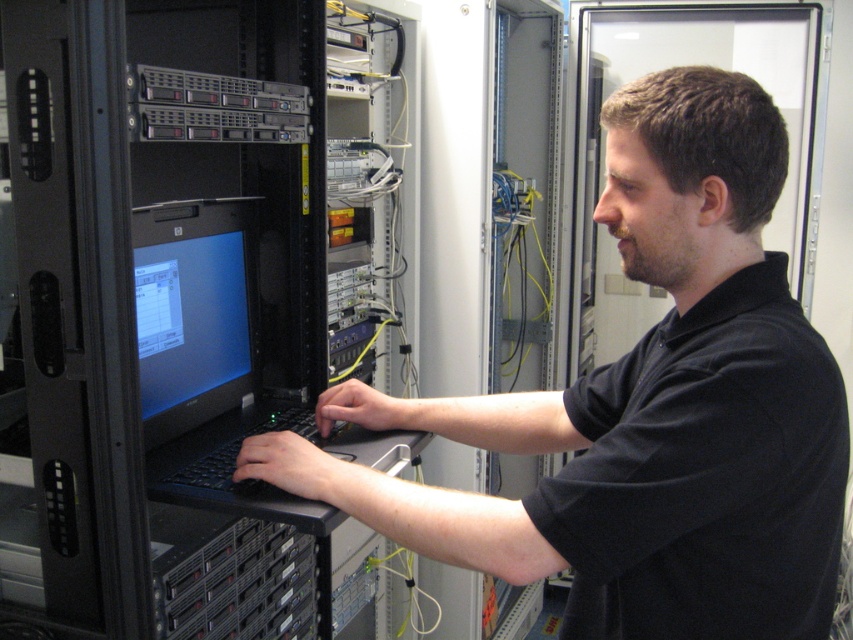
Is black matte computer at center to the right of black matte laptop at center from the viewer's perspective?

Yes, black matte computer at center is to the right of black matte laptop at center.

Does black matte computer at center appear on the left side of black matte laptop at center?

In fact, black matte computer at center is to the right of black matte laptop at center.

Which is behind, point (756, 522) or point (200, 492)?

Point (200, 492)

Locate an element on the screen. The image size is (853, 640). black matte computer at center is located at coordinates (646, 406).

The height and width of the screenshot is (640, 853). I want to click on black matte laptop at center, so click(x=219, y=368).

Is black matte laptop at center closer to the viewer compared to matte black monitor at center-left?

No, it is not.

I want to click on black matte laptop at center, so click(219, 368).

Does black matte computer at center appear on the left side of matte black monitor at center-left?

Incorrect, black matte computer at center is not on the left side of matte black monitor at center-left.

Can you confirm if black matte computer at center is smaller than matte black monitor at center-left?

Incorrect, black matte computer at center is not smaller in size than matte black monitor at center-left.

Is point (357, 413) behind point (169, 272)?

Yes, point (357, 413) is behind point (169, 272).

Find the location of a particular element. This screenshot has width=853, height=640. black matte computer at center is located at coordinates (646, 406).